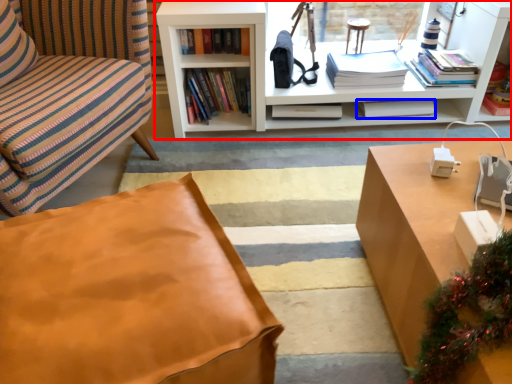
Question: Which point is closer to the camera, bookcase (highlighted by a red box) or book (highlighted by a blue box)?

Choices:
 (A) bookcase
 (B) book

Answer: (A)